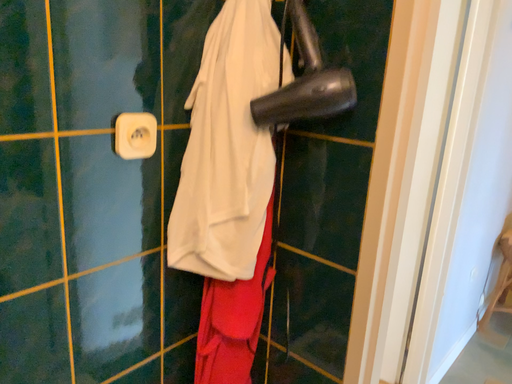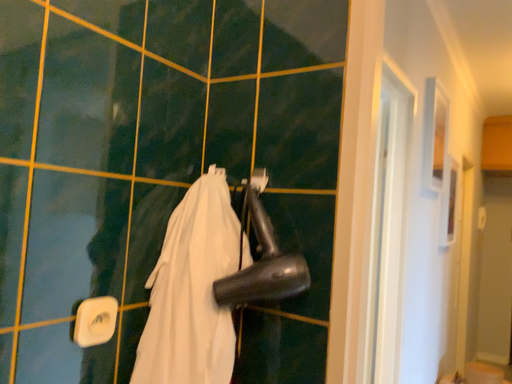
Question: How did the camera likely rotate when shooting the video?

Choices:
 (A) rotated left
 (B) rotated right

Answer: (B)